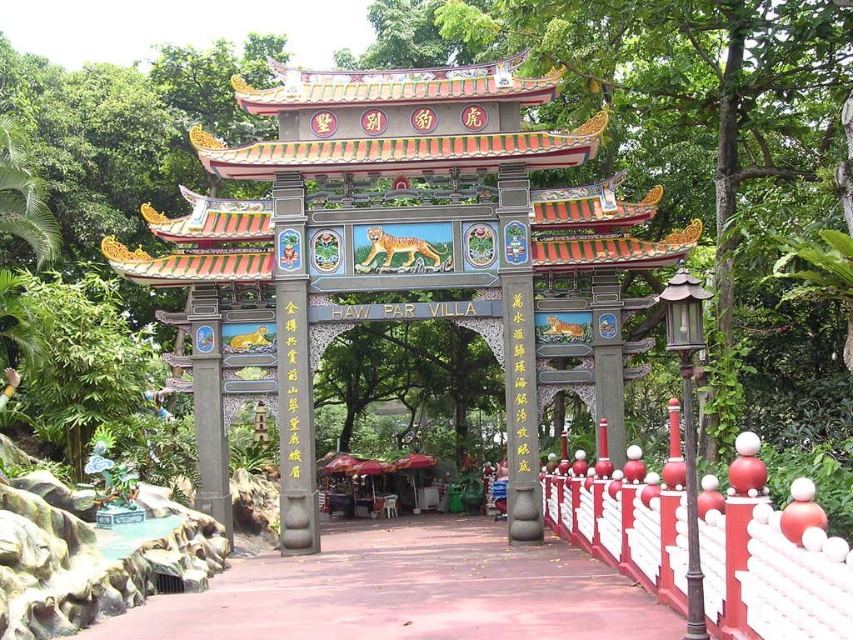
How much distance is there between red concrete path at lower left and white painted wood fence at lower right?

They are 31.97 feet apart.

Which is in front, point (529, 588) or point (753, 522)?

Point (753, 522) is in front.

Image resolution: width=853 pixels, height=640 pixels. Describe the element at coordinates (408, 592) in the screenshot. I see `red concrete path at lower left` at that location.

This screenshot has height=640, width=853. In order to click on red concrete path at lower left in this screenshot , I will do `click(408, 592)`.